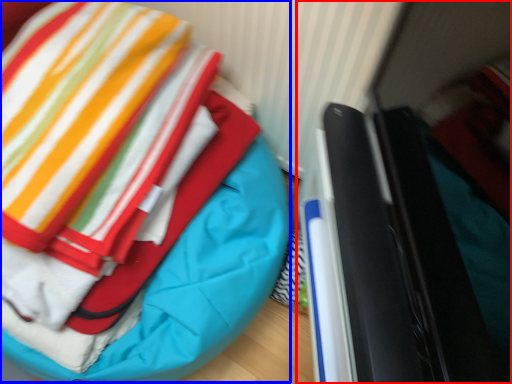
Question: Which object is closer to the camera taking this photo, laptop (highlighted by a red box) or bean bag chair (highlighted by a blue box)?

Choices:
 (A) laptop
 (B) bean bag chair

Answer: (A)